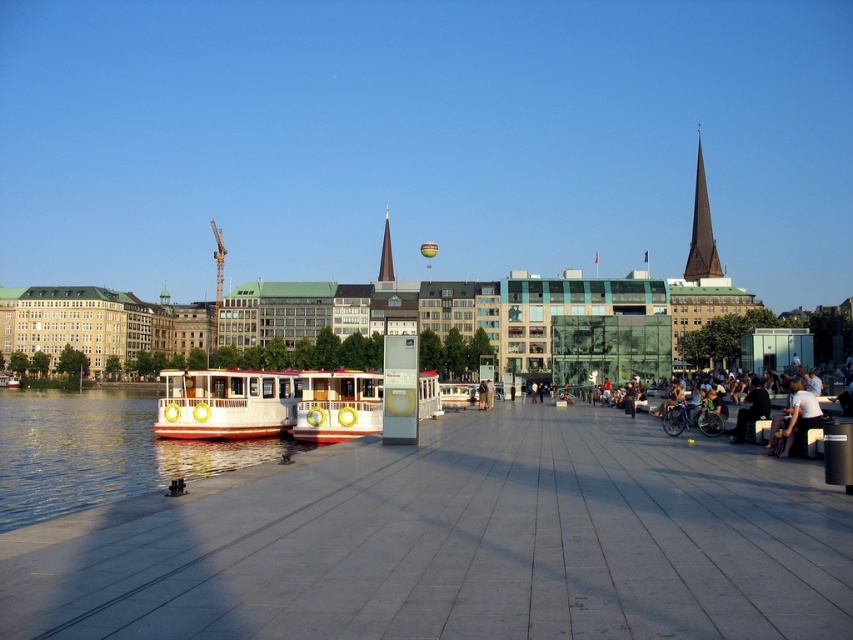
Question: Can you confirm if white glossy water at lower left is wider than white wooden boat at center?

Choices:
 (A) no
 (B) yes

Answer: (B)

Question: Which point is closer to the camera?

Choices:
 (A) dark gray fabric jacket at lower right
 (B) white polished wood boat at left

Answer: (A)

Question: Is white polished wood boat at left above dark gray pants at lower right?

Choices:
 (A) yes
 (B) no

Answer: (A)

Question: Based on their relative distances, which object is nearer to the white concrete dock at center?

Choices:
 (A) white polished wood boat at left
 (B) dark gray fabric jacket at lower right

Answer: (B)

Question: Can you confirm if white glossy water at lower left is thinner than smooth glass spire at center?

Choices:
 (A) no
 (B) yes

Answer: (A)

Question: Which point is closer to the camera?

Choices:
 (A) (788, 406)
 (B) (389, 273)
 (C) (22, 417)
 (D) (737, 531)

Answer: (D)